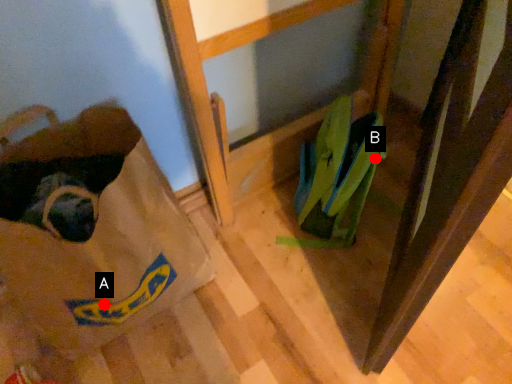
Question: Two points are circled on the image, labeled by A and B beside each circle. Which of the following is the closest to the observer?

Choices:
 (A) A is closer
 (B) B is closer

Answer: (A)